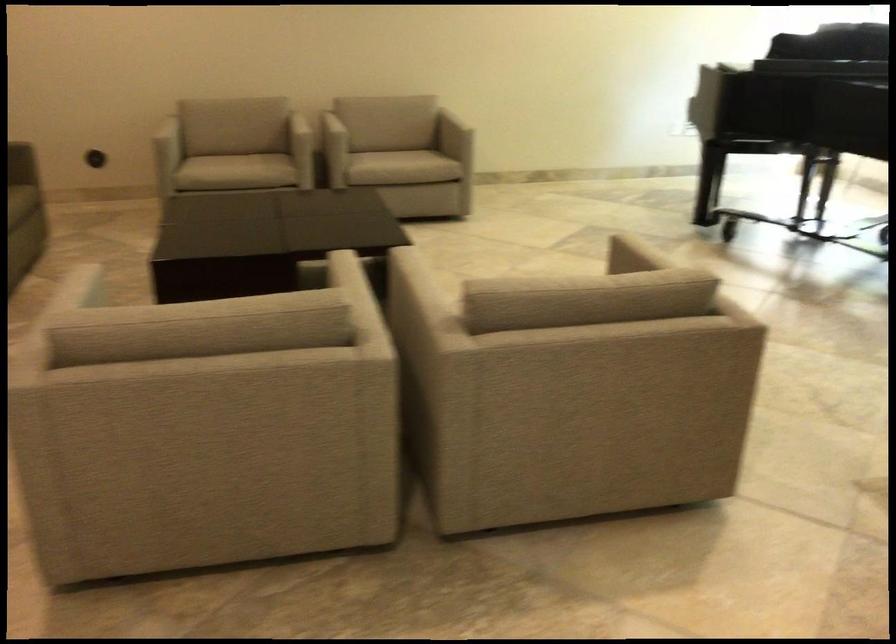
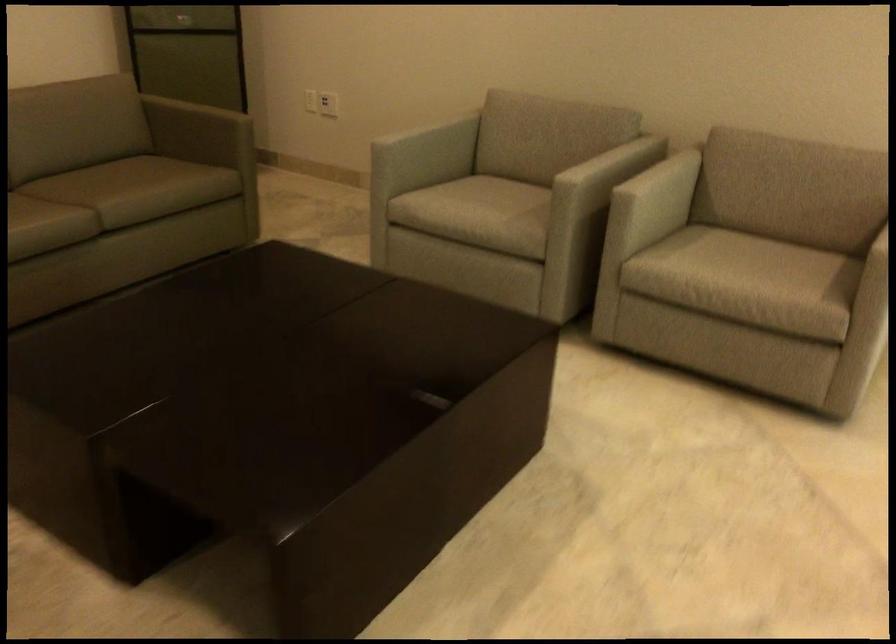
The point at (386, 152) is marked in the first image. Where is the corresponding point in the second image?

(739, 257)